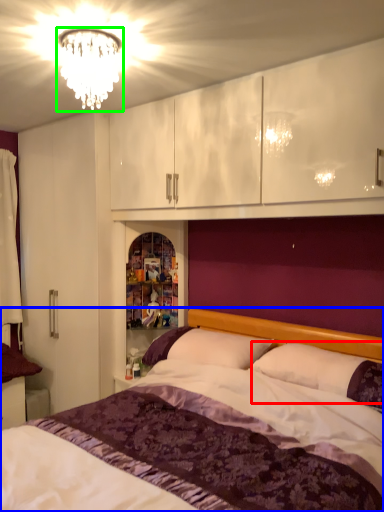
Question: Estimate the real-world distances between objects in this image. Which object is closer to pillow (highlighted by a red box), bed (highlighted by a blue box) or fixture (highlighted by a green box)?

Choices:
 (A) bed
 (B) fixture

Answer: (A)